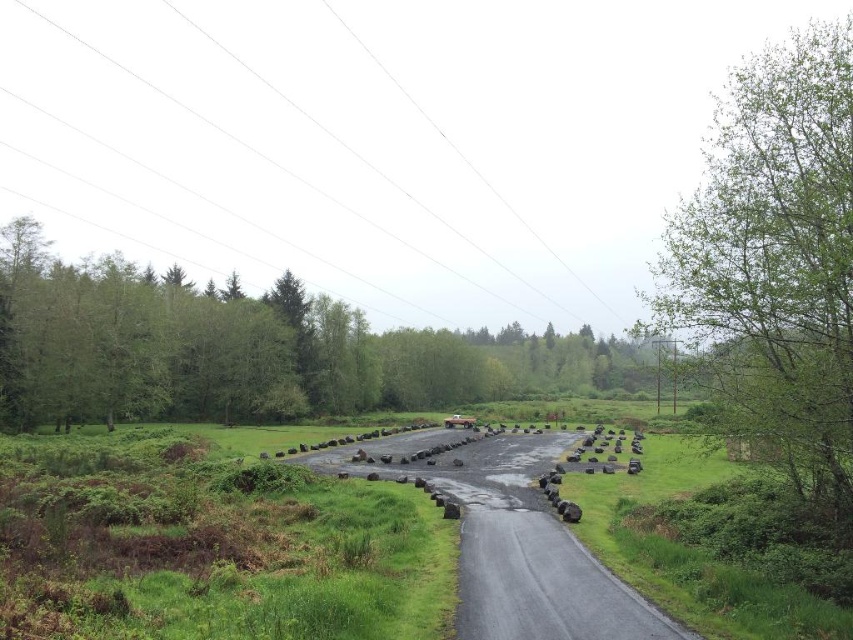
Question: Considering the relative positions of green leafy tree at left and green leafy tree at right in the image provided, where is green leafy tree at left located with respect to green leafy tree at right?

Choices:
 (A) below
 (B) above

Answer: (A)

Question: Which point appears closest to the camera in this image?

Choices:
 (A) (33, 380)
 (B) (842, 374)

Answer: (B)

Question: Which point is closer to the camera taking this photo?

Choices:
 (A) (270, 378)
 (B) (735, 106)

Answer: (B)

Question: Is green leafy tree at left in front of green leafy tree at right?

Choices:
 (A) no
 (B) yes

Answer: (A)

Question: Is green leafy tree at left further to camera compared to green leafy tree at right?

Choices:
 (A) no
 (B) yes

Answer: (B)